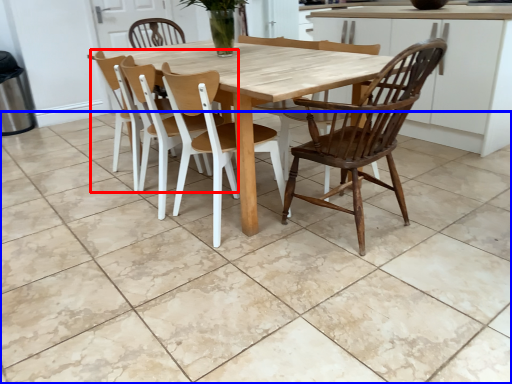
Question: Which point is further to the camera, chair (highlighted by a red box) or tile (highlighted by a blue box)?

Choices:
 (A) chair
 (B) tile

Answer: (A)